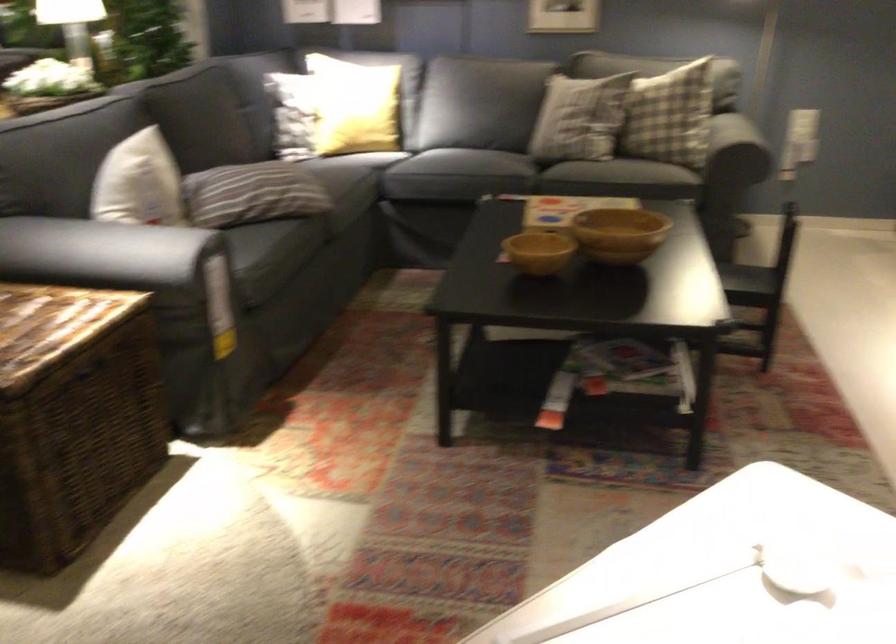
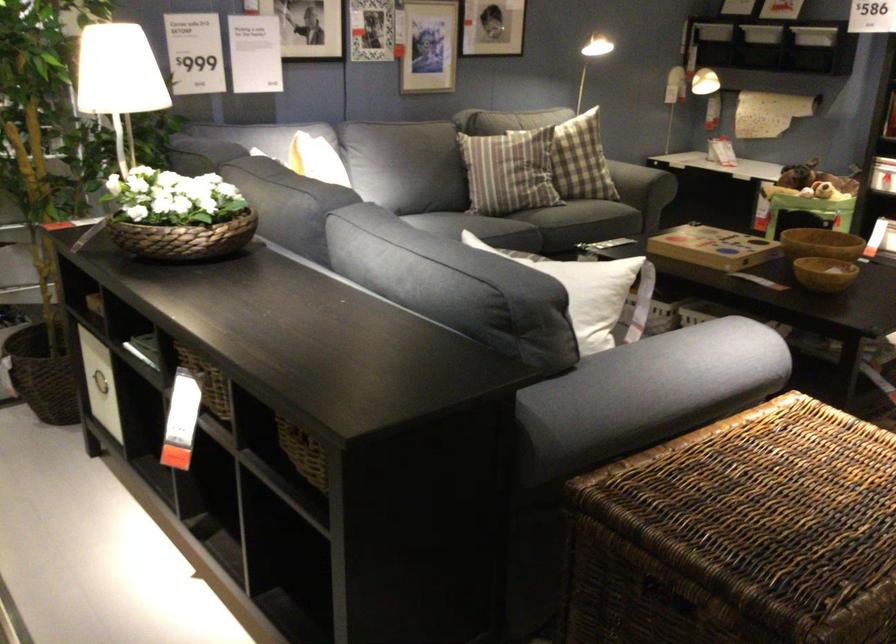
In the second image, find the point that corresponds to point 633,125 in the first image.

(633, 180)